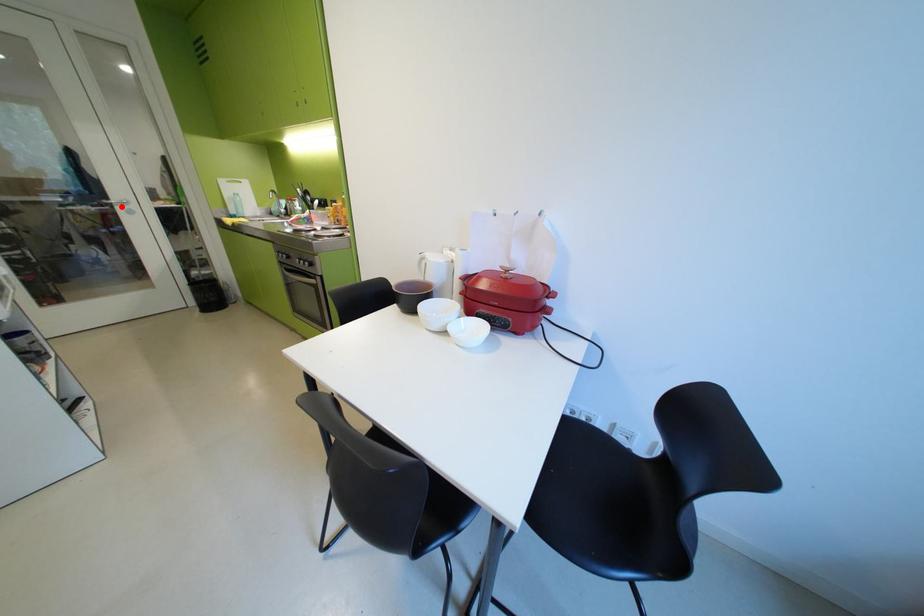
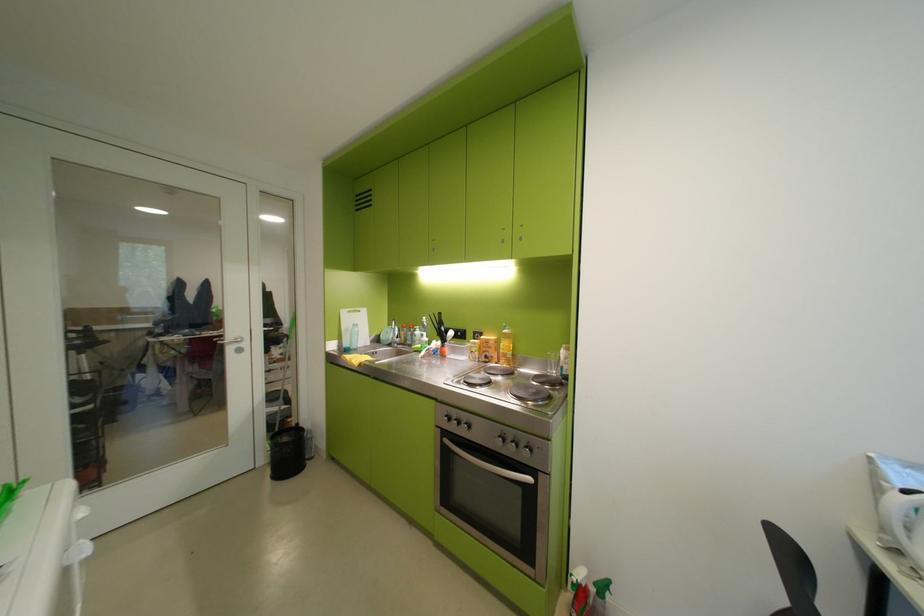
Find the pixel in the second image that matches the highlighted location in the first image.

(233, 346)